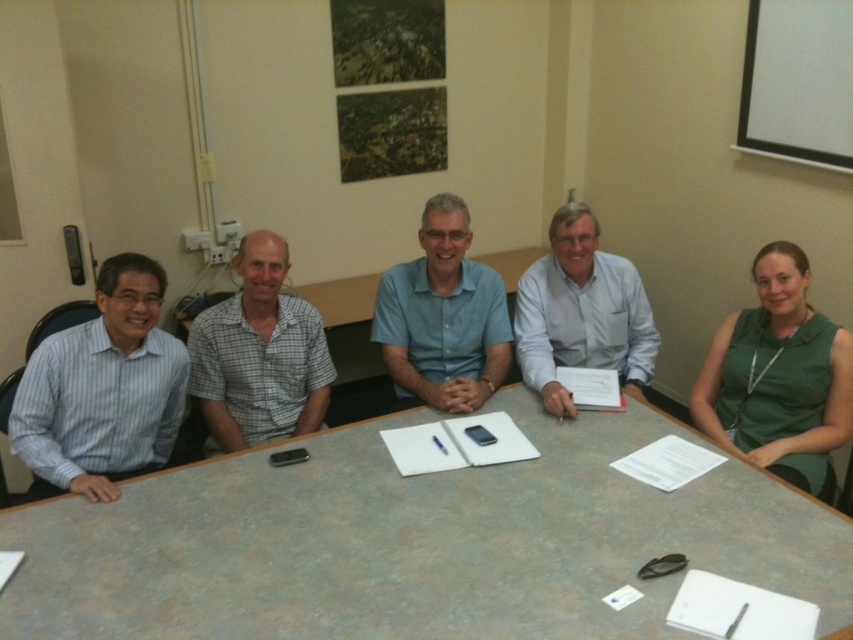
You are sitting at the conference table and need to pass a document to the person wearing the blue cotton shirt at center. Which direction should you move to reach them?

The blue cotton shirt at center is located at point (444, 316), so you should move towards the center of the table to reach them.

You are organizing a group photo and need to arrange the two men in the center of the conference table. The checkered fabric shirt at center and the blue cotton shirt at center are sitting next to each other. Which of their shirts has a narrower width to allow for more space between them?

The checkered fabric shirt at center has a narrower width than the blue cotton shirt at center, so arranging them with the checkered fabric shirt at center closer to the edge would provide more space between them.

You are attending a meeting and need to pass a document to the person wearing the white shirt at center without disturbing others. Which direction should you move relative to the checkered fabric shirt at center?

You should move to the right side of the checkered fabric shirt at center to reach the white shirt at center, as the checkered fabric shirt at center is positioned on the left side of the white shirt at center.